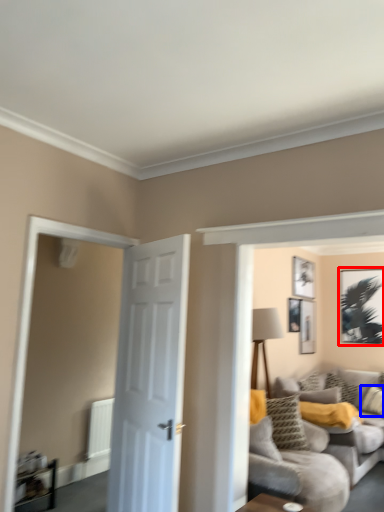
Question: Which object appears closest to the camera in this image, picture frame (highlighted by a red box) or pillow (highlighted by a blue box)?

Choices:
 (A) picture frame
 (B) pillow

Answer: (B)